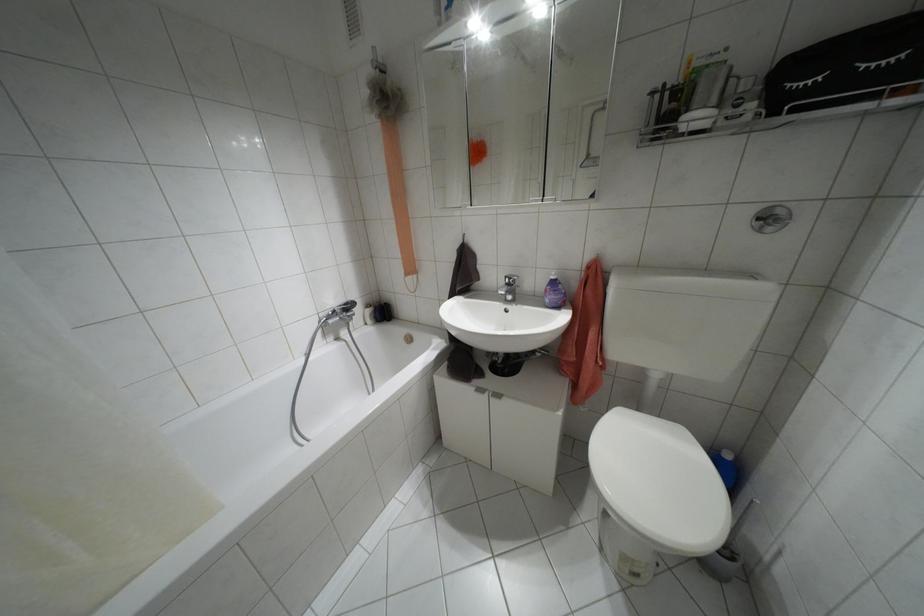
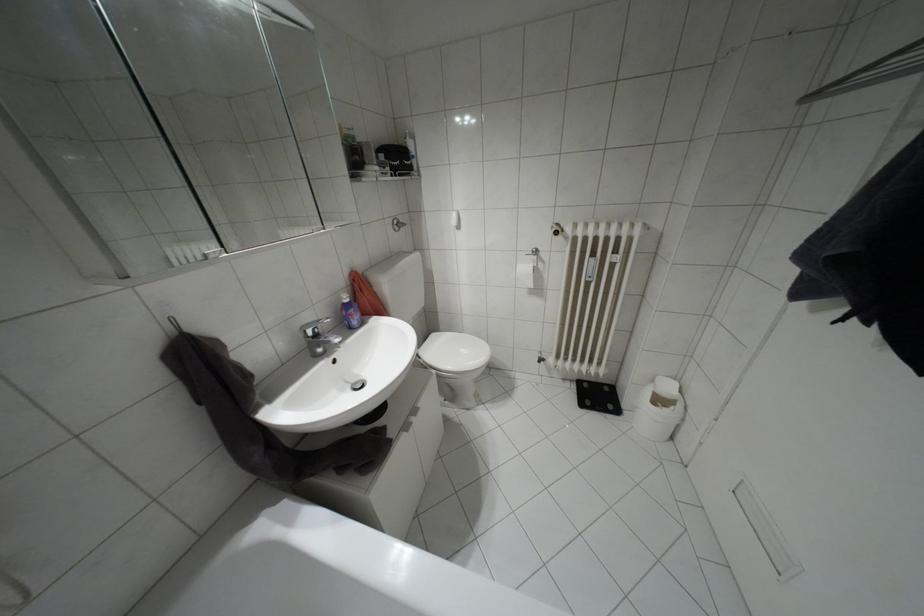
Locate, in the second image, the point that corresponds to (769,228) in the first image.

(395, 229)